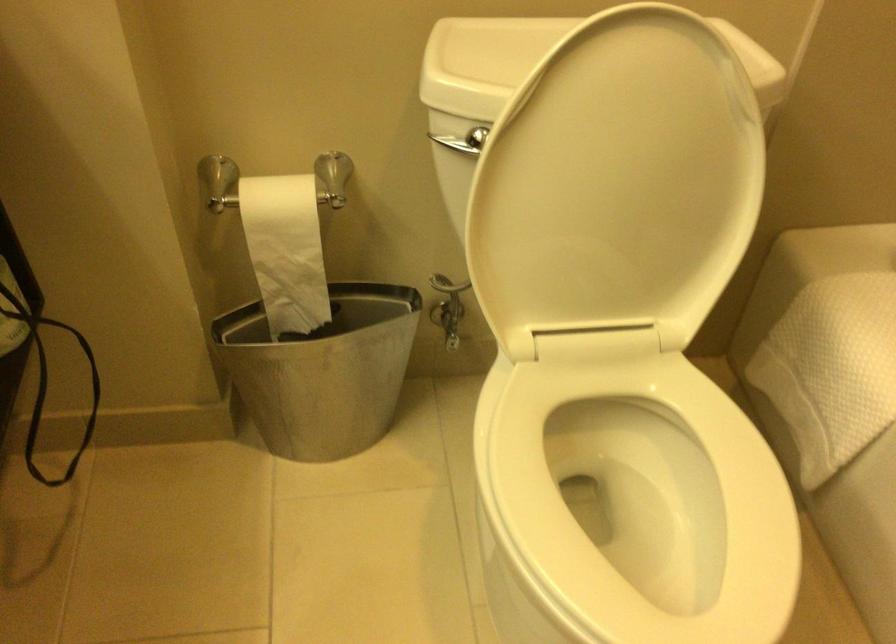
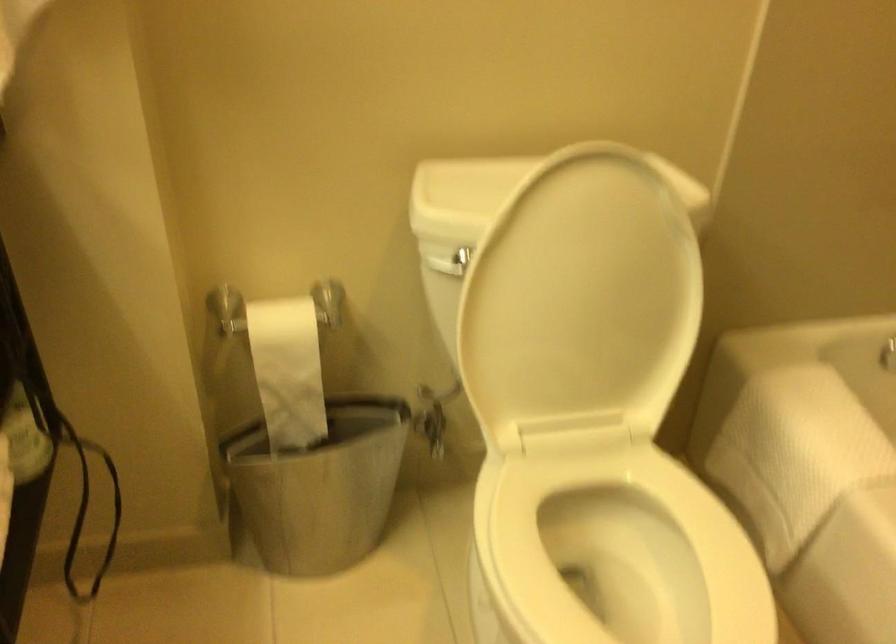
In a continuous first-person perspective shot, in which direction is the camera moving?

The cameraman moved toward left, backward.